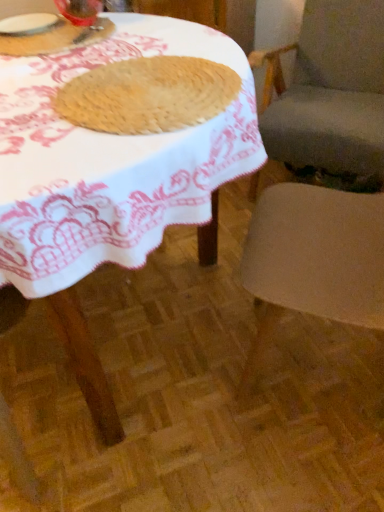
Find the location of a particular element. This screenshot has width=384, height=512. free space in front of smooth beige chair at right, arranged as the 1th chair when viewed from the front is located at coordinates (300, 465).